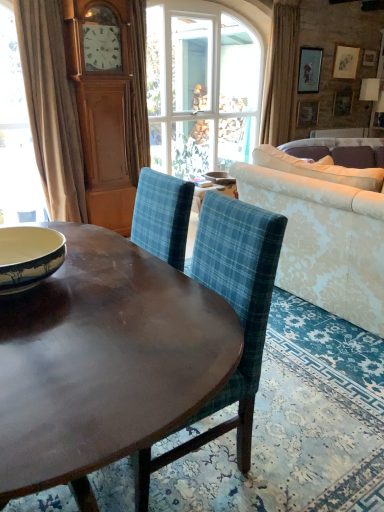
I want to click on vacant space in front of blue and white ceramic bowl at left, marked as the 2th bowl in a back-to-front arrangement, so click(44, 324).